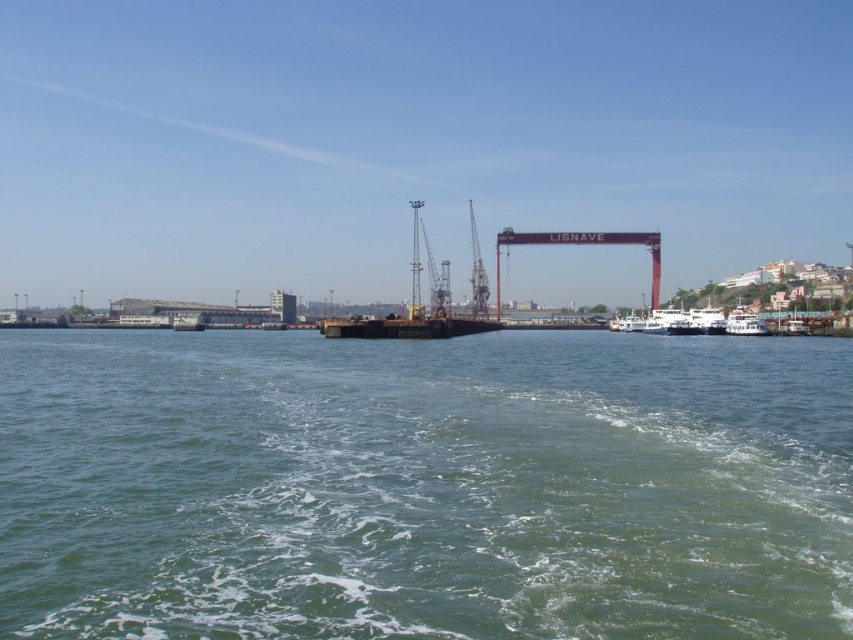
You are an engineer inspecting a shipyard. You see the green water at center and the metallic industrial crane at center. Which object occupies a larger area in the image?

The metallic industrial crane at center occupies a larger area in the image compared to the green water at center, as stated in the description that the green water at center has a smaller size.

You are a maritime engineer assessing the safety of the waterfront area. You notice the green water at center and the metallic industrial crane at center. Which object is located below the other?

The green water at center is positioned under the metallic industrial crane at center, so the water is below the crane.